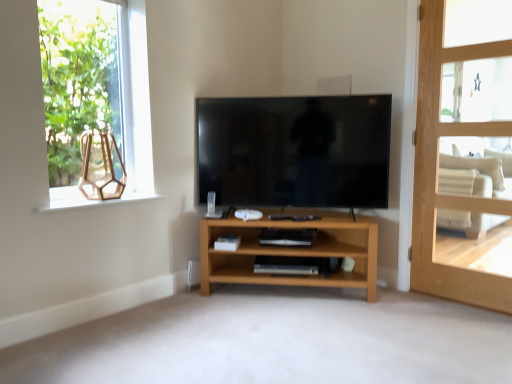
Question: From the image's perspective, would you say black glossy tv at center is shown under matte glass window sill at upper left?

Choices:
 (A) yes
 (B) no

Answer: (B)

Question: Considering the relative sizes of black glossy tv at center and matte glass window sill at upper left in the image provided, is black glossy tv at center bigger than matte glass window sill at upper left?

Choices:
 (A) no
 (B) yes

Answer: (B)

Question: From a real-world perspective, is black glossy tv at center physically below matte glass window sill at upper left?

Choices:
 (A) yes
 (B) no

Answer: (B)

Question: Is black glossy tv at center smaller than matte glass window sill at upper left?

Choices:
 (A) no
 (B) yes

Answer: (A)

Question: Is black glossy tv at center aimed at matte glass window sill at upper left?

Choices:
 (A) yes
 (B) no

Answer: (B)

Question: Which is correct: clear glass window at upper left is inside light brown wooden door at right, or outside of it?

Choices:
 (A) outside
 (B) inside

Answer: (A)

Question: Relative to light brown wooden door at right, is clear glass window at upper left in front or behind?

Choices:
 (A) front
 (B) behind

Answer: (B)

Question: From the image's perspective, is clear glass window at upper left positioned above or below light brown wooden door at right?

Choices:
 (A) above
 (B) below

Answer: (A)

Question: Looking at the image, does clear glass window at upper left seem bigger or smaller compared to light brown wooden door at right?

Choices:
 (A) big
 (B) small

Answer: (B)

Question: Looking at their shapes, would you say black glossy tv at center is wider or thinner than matte glass window sill at upper left?

Choices:
 (A) thin
 (B) wide

Answer: (A)

Question: From the image's perspective, relative to matte glass window sill at upper left, is black glossy tv at center above or below?

Choices:
 (A) above
 (B) below

Answer: (A)

Question: From a real-world perspective, is black glossy tv at center physically located above or below matte glass window sill at upper left?

Choices:
 (A) below
 (B) above

Answer: (B)

Question: Based on their sizes in the image, would you say black glossy tv at center is bigger or smaller than matte glass window sill at upper left?

Choices:
 (A) big
 (B) small

Answer: (A)

Question: Is black glossy tv at center in front of or behind beige fabric armchair at right in the image?

Choices:
 (A) behind
 (B) front

Answer: (B)

Question: From a real-world perspective, is black glossy tv at center above or below beige fabric armchair at right?

Choices:
 (A) above
 (B) below

Answer: (A)